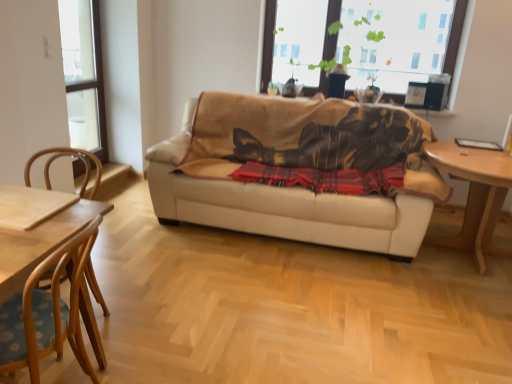
Where is `vacant space in front of light brown wooden table at right`? vacant space in front of light brown wooden table at right is located at coordinates (457, 310).